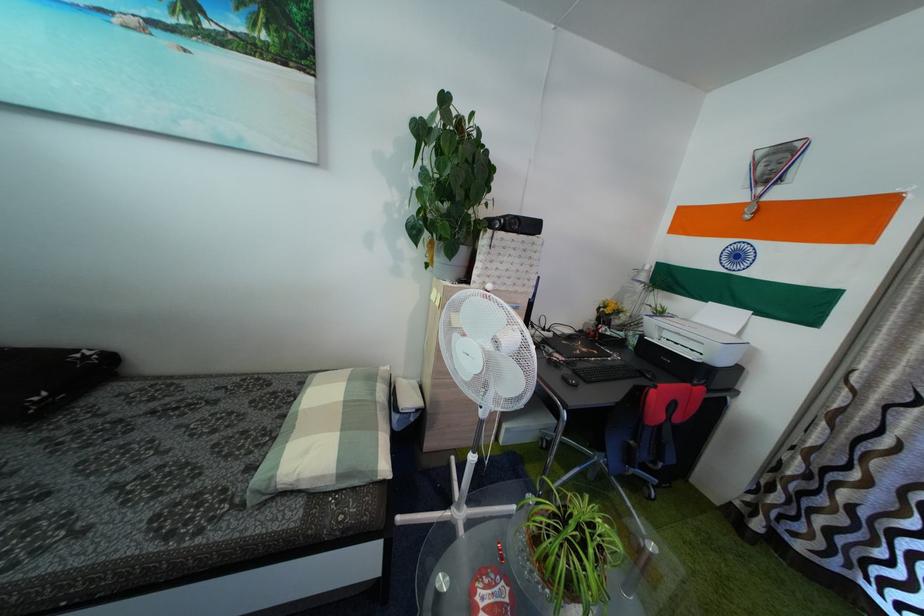
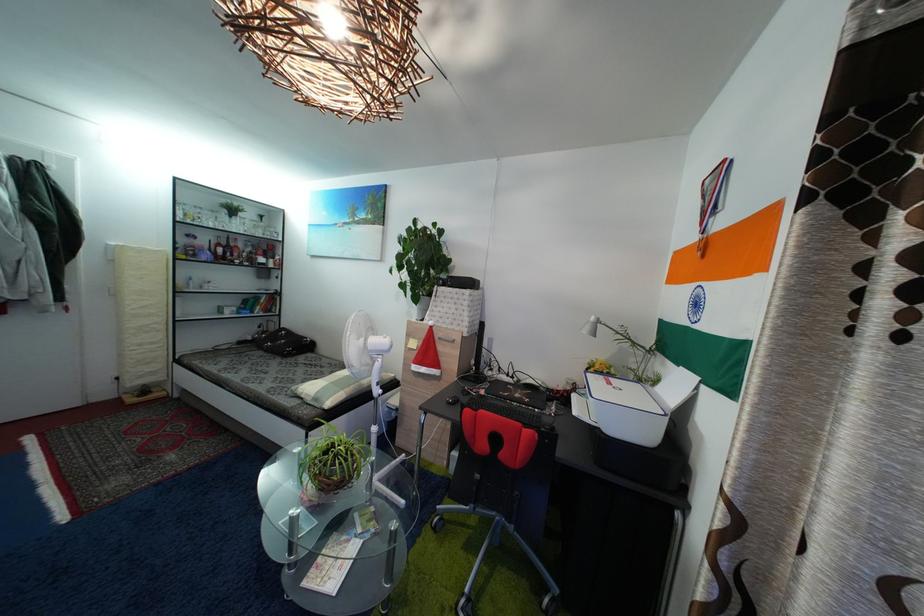
Locate, in the second image, the point that corresponds to pixel 608 315 in the first image.

(596, 377)